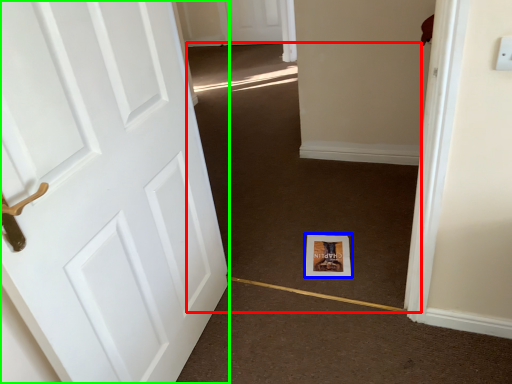
Question: Estimate the real-world distances between objects in this image. Which object is closer to plain (highlighted by a red box), print (highlighted by a blue box) or door (highlighted by a green box)?

Choices:
 (A) print
 (B) door

Answer: (A)